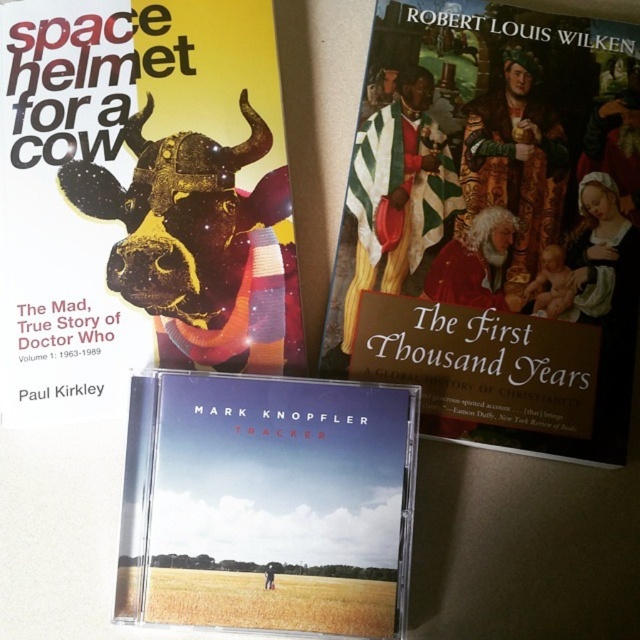
You are standing at the point marked as point [486,196] and want to pick up an object that is 38.55 inches away from you. Can you reach it without moving your feet?

Yes, you can reach the object because the distance between you and the object is 38.55 inches, which is within the typical human arm reach range.

You are a photographer standing 1 meter away from the matte gold book at center. Can you reach it without moving your feet?

The matte gold book at center is 91.13 centimeters away from the camera, so since you are standing 1 meter away, you can reach it without moving your feet because the distance is within arm reach.